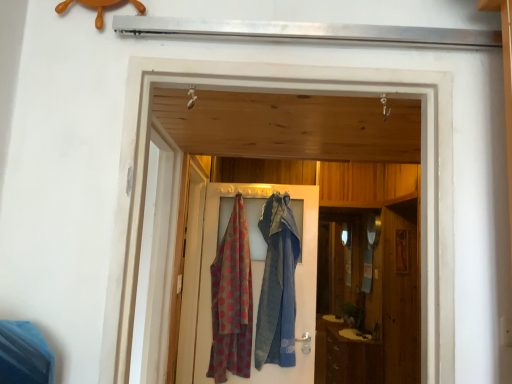
Question: Is polka dot fabric at center surrounded by wooden screen door at center, which appears as the second screen door when viewed from the front?

Choices:
 (A) no
 (B) yes

Answer: (A)

Question: Is wooden screen door at center, which appears as the second screen door when viewed from the front, oriented away from polka dot fabric at center?

Choices:
 (A) no
 (B) yes

Answer: (B)

Question: Is wooden screen door at center, which appears as the second screen door when viewed from the front, next to polka dot fabric at center?

Choices:
 (A) yes
 (B) no

Answer: (B)

Question: Is wooden screen door at center, the 1th screen door from the back, thinner than polka dot fabric at center?

Choices:
 (A) no
 (B) yes

Answer: (B)

Question: Is wooden screen door at center, which appears as the second screen door when viewed from the front, to the right of polka dot fabric at center from the viewer's perspective?

Choices:
 (A) yes
 (B) no

Answer: (B)

Question: Is the position of wooden screen door at center, the 1th screen door from the back, more distant than that of polka dot fabric at center?

Choices:
 (A) yes
 (B) no

Answer: (B)

Question: Would you consider polka dot fabric at center to be distant from wooden screen door at center, the 1th screen door from the back?

Choices:
 (A) yes
 (B) no

Answer: (B)

Question: Is the position of polka dot fabric at center more distant than that of wooden screen door at center, the 1th screen door from the back?

Choices:
 (A) yes
 (B) no

Answer: (A)

Question: Is polka dot fabric at center next to wooden screen door at center, the 1th screen door from the back, and touching it?

Choices:
 (A) yes
 (B) no

Answer: (B)

Question: Does polka dot fabric at center have a greater height compared to wooden screen door at center, the 1th screen door from the back?

Choices:
 (A) no
 (B) yes

Answer: (A)

Question: Does polka dot fabric at center appear on the left side of wooden screen door at center, which appears as the second screen door when viewed from the front?

Choices:
 (A) no
 (B) yes

Answer: (A)

Question: Can wooden screen door at center, which appears as the second screen door when viewed from the front, be found inside polka dot fabric at center?

Choices:
 (A) no
 (B) yes

Answer: (A)

Question: Considering the relative positions of brown wood cabinet at lower right and polka dot fabric at center in the image provided, is brown wood cabinet at lower right to the left of polka dot fabric at center from the viewer's perspective?

Choices:
 (A) yes
 (B) no

Answer: (B)